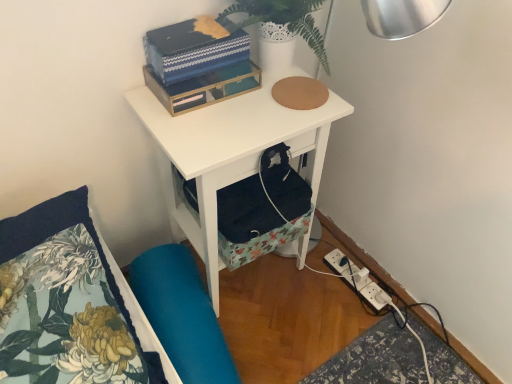
You are a GUI agent. You are given a task and a screenshot of the screen. Output one action in this format:
    pyautogui.click(x=<x>, y=<y>)
    Task: Click on the free area in between white matte nightstand at upper center and teal fabric swivel chair at lower left
    The width and height of the screenshot is (512, 384).
    Given the screenshot: What is the action you would take?
    pyautogui.click(x=259, y=337)